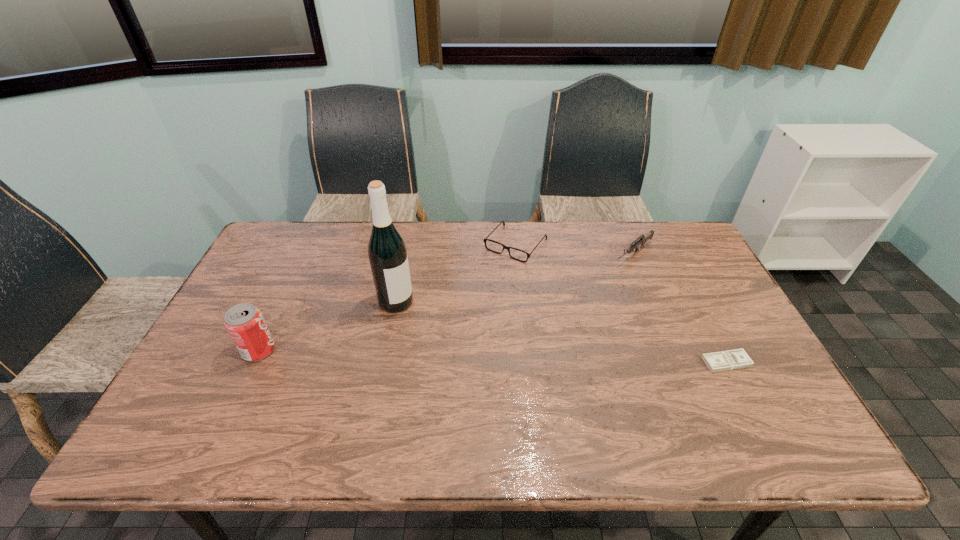
At what (x,y) coordinates should I click in order to perform the action: click on vacant area located 0.080m on the front-facing side of the fourth tallest object. Please return your answer as a coordinate pair (x, y). Image resolution: width=960 pixels, height=540 pixels. Looking at the image, I should click on (489, 276).

The image size is (960, 540). I want to click on free space located 0.200m on the front-facing side of the fourth tallest object, so click(x=469, y=300).

Find the location of a particular element. vacant space located 0.320m on the front-facing side of the fourth tallest object is located at coordinates (447, 326).

Where is `free region located 0.330m on the label of the third nearest object`? This screenshot has width=960, height=540. free region located 0.330m on the label of the third nearest object is located at coordinates (495, 374).

Locate an element on the screen. This screenshot has width=960, height=540. vacant space located on the label of the third nearest object is located at coordinates pos(452,342).

Where is `free space located on the label of the third nearest object`? free space located on the label of the third nearest object is located at coordinates (420, 319).

Image resolution: width=960 pixels, height=540 pixels. I want to click on blank area located 0.160m aimed along the barrel of the gun, so click(590, 286).

Locate an element on the screen. This screenshot has height=540, width=960. free spot located aimed along the barrel of the gun is located at coordinates [545, 321].

Find the location of a particular element. The height and width of the screenshot is (540, 960). vacant region located 0.270m aimed along the barrel of the gun is located at coordinates (568, 304).

Locate an element on the screen. The width and height of the screenshot is (960, 540). spectacles that is at the far edge is located at coordinates (484, 240).